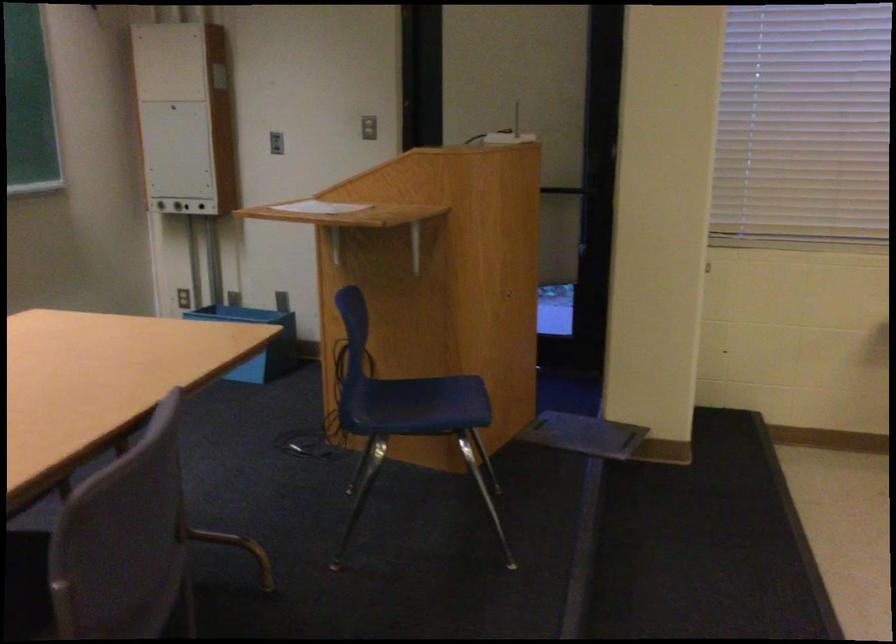
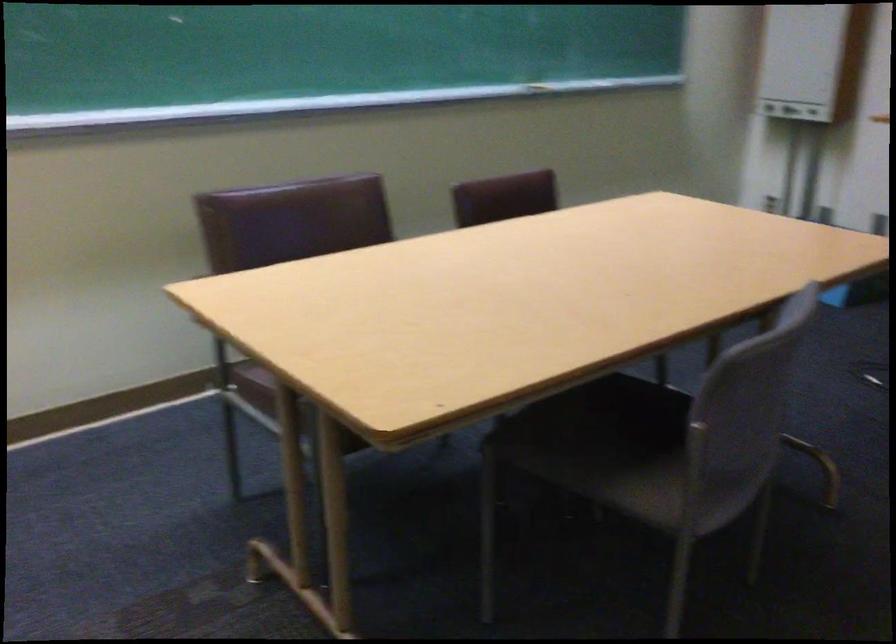
Question: The camera is either moving clockwise (left) or counter-clockwise (right) around the object. The first image is from the beginning of the video and the second image is from the end. Is the camera moving left or right when shooting the video?

Choices:
 (A) Left
 (B) Right

Answer: (B)